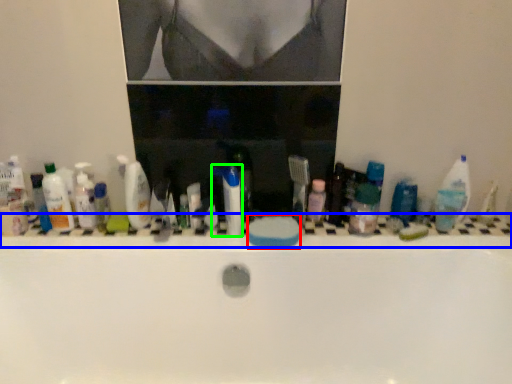
Question: Based on their relative distances, which object is nearer to soap (highlighted by a red box)? Choose from ledge (highlighted by a blue box) and toothpaste (highlighted by a green box).

Choices:
 (A) ledge
 (B) toothpaste

Answer: (B)